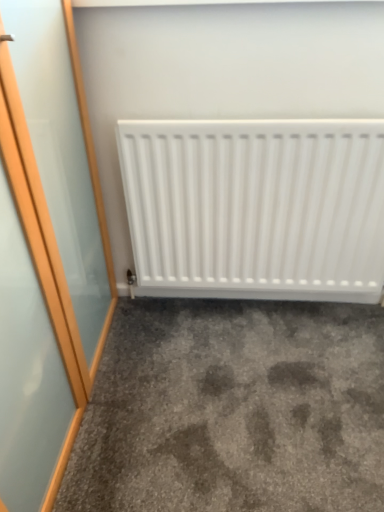
Question: Is gray carpet at lower center at the left side of white matte radiator at center?

Choices:
 (A) no
 (B) yes

Answer: (B)

Question: Is gray carpet at lower center next to white matte radiator at center?

Choices:
 (A) yes
 (B) no

Answer: (B)

Question: Is gray carpet at lower center further to camera compared to white matte radiator at center?

Choices:
 (A) no
 (B) yes

Answer: (A)

Question: Does gray carpet at lower center have a lesser width compared to white matte radiator at center?

Choices:
 (A) yes
 (B) no

Answer: (B)

Question: From a real-world perspective, does gray carpet at lower center stand above white matte radiator at center?

Choices:
 (A) yes
 (B) no

Answer: (B)

Question: Is gray carpet at lower center at the right side of white matte radiator at center?

Choices:
 (A) no
 (B) yes

Answer: (A)

Question: Considering the relative sizes of white matte radiator at center and gray carpet at lower center in the image provided, is white matte radiator at center wider than gray carpet at lower center?

Choices:
 (A) no
 (B) yes

Answer: (A)

Question: Could you tell me if white matte radiator at center is turned towards gray carpet at lower center?

Choices:
 (A) no
 (B) yes

Answer: (B)

Question: Considering the relative positions of white matte radiator at center and gray carpet at lower center in the image provided, is white matte radiator at center to the left of gray carpet at lower center from the viewer's perspective?

Choices:
 (A) yes
 (B) no

Answer: (B)

Question: From a real-world perspective, is white matte radiator at center positioned under gray carpet at lower center based on gravity?

Choices:
 (A) no
 (B) yes

Answer: (A)

Question: Considering the relative positions of white matte radiator at center and gray carpet at lower center in the image provided, is white matte radiator at center to the right of gray carpet at lower center from the viewer's perspective?

Choices:
 (A) no
 (B) yes

Answer: (B)

Question: From a real-world perspective, is white matte radiator at center located higher than gray carpet at lower center?

Choices:
 (A) yes
 (B) no

Answer: (A)

Question: Would you say white matte radiator at center is inside or outside gray carpet at lower center?

Choices:
 (A) outside
 (B) inside

Answer: (A)